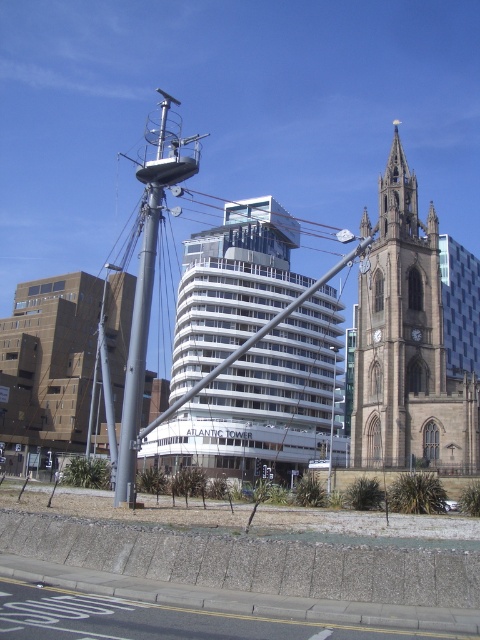
Question: Which point is closer to the camera?

Choices:
 (A) brown stone clock tower at center
 (B) polished silver spire at center

Answer: (B)

Question: Can you confirm if brown brick church at center is positioned to the right of polished silver spire at center?

Choices:
 (A) no
 (B) yes

Answer: (A)

Question: Which of these objects is positioned farthest from the brown brick church at center?

Choices:
 (A) polished silver spire at center
 (B) brown stone clock tower at center

Answer: (B)

Question: Which object is positioned closest to the brown stone clock tower at center?

Choices:
 (A) polished silver spire at center
 (B) brown brick church at center

Answer: (A)

Question: Can you confirm if brown stone clock tower at center is positioned to the right of brown brick church at center?

Choices:
 (A) yes
 (B) no

Answer: (A)

Question: In this image, where is brown brick church at center located relative to polished silver spire at center?

Choices:
 (A) right
 (B) left

Answer: (B)